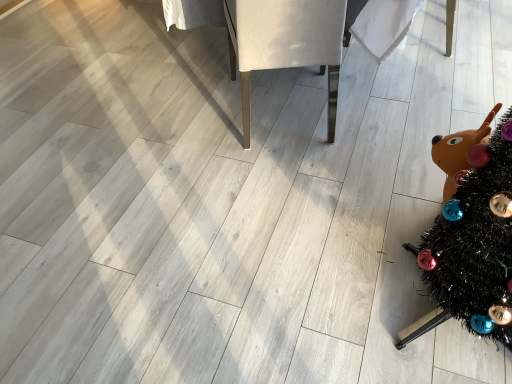
The image size is (512, 384). I want to click on free point to the left of black tinsel christmas tree at lower right, so click(335, 294).